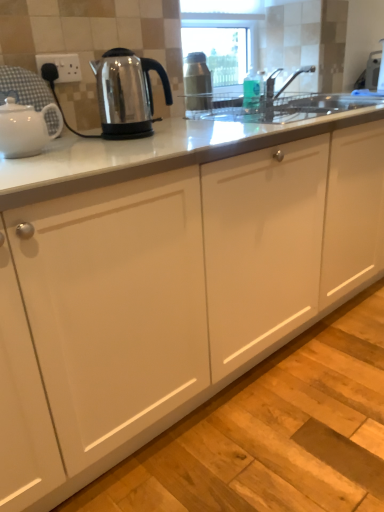
What do you see at coordinates (127, 93) in the screenshot? I see `stainless steel kettle at left, the second kettle viewed from the left` at bounding box center [127, 93].

The image size is (384, 512). What do you see at coordinates (26, 129) in the screenshot? I see `white glossy teapot at left, marked as the 2th kettle in a right-to-left arrangement` at bounding box center [26, 129].

How much space does white glossy teapot at left, placed as the first kettle when sorted from left to right, occupy vertically?

5.67 inches.

Where is `stainless steel kettle at left, positioned as the 1th kettle in right-to-left order`? This screenshot has height=512, width=384. stainless steel kettle at left, positioned as the 1th kettle in right-to-left order is located at coordinates coord(127,93).

Which of these two, stainless steel kettle at left, the second kettle viewed from the left, or white glossy teapot at left, marked as the 2th kettle in a right-to-left arrangement, stands taller?

With more height is stainless steel kettle at left, the second kettle viewed from the left.

Is stainless steel kettle at left, positioned as the 1th kettle in right-to-left order, far from white glossy teapot at left, placed as the first kettle when sorted from left to right?

That's not correct — stainless steel kettle at left, positioned as the 1th kettle in right-to-left order, is a little close to white glossy teapot at left, placed as the first kettle when sorted from left to right.

Is stainless steel kettle at left, the second kettle viewed from the left, closer to camera compared to white glossy teapot at left, marked as the 2th kettle in a right-to-left arrangement?

That is False.

Is stainless steel kettle at left, positioned as the 1th kettle in right-to-left order, located outside white glossy teapot at left, placed as the first kettle when sorted from left to right?

Yes, stainless steel kettle at left, positioned as the 1th kettle in right-to-left order, is located beyond the bounds of white glossy teapot at left, placed as the first kettle when sorted from left to right.

Locate an element on the screen. This screenshot has width=384, height=512. the 1st kettle in front of the white plastic socket at upper left, starting your count from the anchor is located at coordinates (127, 93).

Which of these two, white plastic socket at upper left or stainless steel kettle at left, positioned as the 1th kettle in right-to-left order, stands shorter?

white plastic socket at upper left.

Is white plastic socket at upper left in contact with stainless steel kettle at left, positioned as the 1th kettle in right-to-left order?

white plastic socket at upper left and stainless steel kettle at left, positioned as the 1th kettle in right-to-left order, are clearly separated.

From the image's perspective, is white plastic socket at upper left over stainless steel kettle at left, positioned as the 1th kettle in right-to-left order?

Yes, from the image's perspective, white plastic socket at upper left is above stainless steel kettle at left, positioned as the 1th kettle in right-to-left order.

Based on the photo, does white glossy teapot at left, placed as the first kettle when sorted from left to right, have a greater height compared to white plastic socket at upper left?

Yes.

Who is bigger, white glossy teapot at left, marked as the 2th kettle in a right-to-left arrangement, or white plastic socket at upper left?

With larger size is white glossy teapot at left, marked as the 2th kettle in a right-to-left arrangement.

Locate an element on the screen. electric outlet to the right of white glossy teapot at left, marked as the 2th kettle in a right-to-left arrangement is located at coordinates (61, 66).

Is white glossy teapot at left, placed as the first kettle when sorted from left to right, further to camera compared to white plastic socket at upper left?

No, white glossy teapot at left, placed as the first kettle when sorted from left to right, is closer to the viewer.

Is white plastic socket at upper left facing away from white glossy teapot at left, marked as the 2th kettle in a right-to-left arrangement?

No.

In the image, is white plastic socket at upper left positioned in front of or behind white glossy teapot at left, marked as the 2th kettle in a right-to-left arrangement?

Visually, white plastic socket at upper left is located behind white glossy teapot at left, marked as the 2th kettle in a right-to-left arrangement.

From a real-world perspective, is white plastic socket at upper left positioned above or below white glossy teapot at left, marked as the 2th kettle in a right-to-left arrangement?

white plastic socket at upper left is above white glossy teapot at left, marked as the 2th kettle in a right-to-left arrangement.

Can you tell me how much white glossy teapot at left, placed as the first kettle when sorted from left to right, and stainless steel kettle at left, positioned as the 1th kettle in right-to-left order, differ in facing direction?

0.0044 degrees separate the facing orientations of white glossy teapot at left, placed as the first kettle when sorted from left to right, and stainless steel kettle at left, positioned as the 1th kettle in right-to-left order.

From their relative heights in the image, would you say white glossy teapot at left, placed as the first kettle when sorted from left to right, is taller or shorter than stainless steel kettle at left, positioned as the 1th kettle in right-to-left order?

In the image, white glossy teapot at left, placed as the first kettle when sorted from left to right, appears to be shorter than stainless steel kettle at left, positioned as the 1th kettle in right-to-left order.

Considering the positions of objects white glossy teapot at left, marked as the 2th kettle in a right-to-left arrangement, and stainless steel kettle at left, the second kettle viewed from the left, in the image provided, who is behind, white glossy teapot at left, marked as the 2th kettle in a right-to-left arrangement, or stainless steel kettle at left, the second kettle viewed from the left,?

stainless steel kettle at left, the second kettle viewed from the left, is further from the camera.

The image size is (384, 512). I want to click on kettle in front of the stainless steel kettle at left, positioned as the 1th kettle in right-to-left order, so click(x=26, y=129).

Between stainless steel kettle at left, positioned as the 1th kettle in right-to-left order, and white plastic socket at upper left, which one has smaller size?

With smaller size is white plastic socket at upper left.

Measure the distance between stainless steel kettle at left, positioned as the 1th kettle in right-to-left order, and white plastic socket at upper left.

stainless steel kettle at left, positioned as the 1th kettle in right-to-left order, and white plastic socket at upper left are 8.67 inches apart from each other.

Is stainless steel kettle at left, the second kettle viewed from the left, shorter than white plastic socket at upper left?

No.

Is white plastic socket at upper left surrounded by stainless steel kettle at left, positioned as the 1th kettle in right-to-left order?

No, white plastic socket at upper left is not a part of stainless steel kettle at left, positioned as the 1th kettle in right-to-left order.

What are the coordinates of `kettle located in front of the stainless steel kettle at left, the second kettle viewed from the left` in the screenshot? It's located at (26, 129).

The image size is (384, 512). Find the location of `electric outlet above the stainless steel kettle at left, positioned as the 1th kettle in right-to-left order (from a real-world perspective)`. electric outlet above the stainless steel kettle at left, positioned as the 1th kettle in right-to-left order (from a real-world perspective) is located at coordinates (61, 66).

When comparing their distances from stainless steel kettle at left, the second kettle viewed from the left, does white glossy teapot at left, marked as the 2th kettle in a right-to-left arrangement, or white plastic socket at upper left seem closer?

Among the two, white plastic socket at upper left is located nearer to stainless steel kettle at left, the second kettle viewed from the left.

Which object lies nearer to the anchor point white glossy teapot at left, placed as the first kettle when sorted from left to right, stainless steel kettle at left, the second kettle viewed from the left, or white plastic socket at upper left?

The object closer to white glossy teapot at left, placed as the first kettle when sorted from left to right, is stainless steel kettle at left, the second kettle viewed from the left.

Considering their positions, is stainless steel kettle at left, positioned as the 1th kettle in right-to-left order, positioned further to white plastic socket at upper left than white glossy teapot at left, placed as the first kettle when sorted from left to right?

white glossy teapot at left, placed as the first kettle when sorted from left to right, lies further to white plastic socket at upper left than the other object.

Looking at the image, which one is located closer to stainless steel kettle at left, the second kettle viewed from the left, white plastic socket at upper left or white glossy teapot at left, placed as the first kettle when sorted from left to right?

white plastic socket at upper left lies closer to stainless steel kettle at left, the second kettle viewed from the left, than the other object.

From the image, which object appears to be farther from white glossy teapot at left, placed as the first kettle when sorted from left to right, white plastic socket at upper left or stainless steel kettle at left, positioned as the 1th kettle in right-to-left order?

white plastic socket at upper left lies further to white glossy teapot at left, placed as the first kettle when sorted from left to right, than the other object.

Which object lies further to the anchor point white plastic socket at upper left, white glossy teapot at left, placed as the first kettle when sorted from left to right, or stainless steel kettle at left, the second kettle viewed from the left?

Based on the image, white glossy teapot at left, placed as the first kettle when sorted from left to right, appears to be further to white plastic socket at upper left.

Image resolution: width=384 pixels, height=512 pixels. In order to click on kettle between white glossy teapot at left, placed as the first kettle when sorted from left to right, and white plastic socket at upper left from front to back in this screenshot , I will do (127, 93).